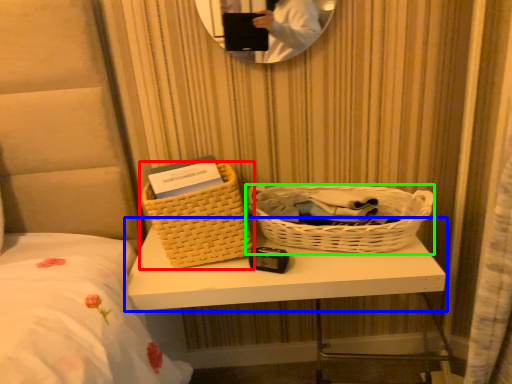
Question: Estimate the real-world distances between objects in this image. Which object is farther from picnic basket (highlighted by a red box), table (highlighted by a blue box) or picnic basket (highlighted by a green box)?

Choices:
 (A) table
 (B) picnic basket

Answer: (B)